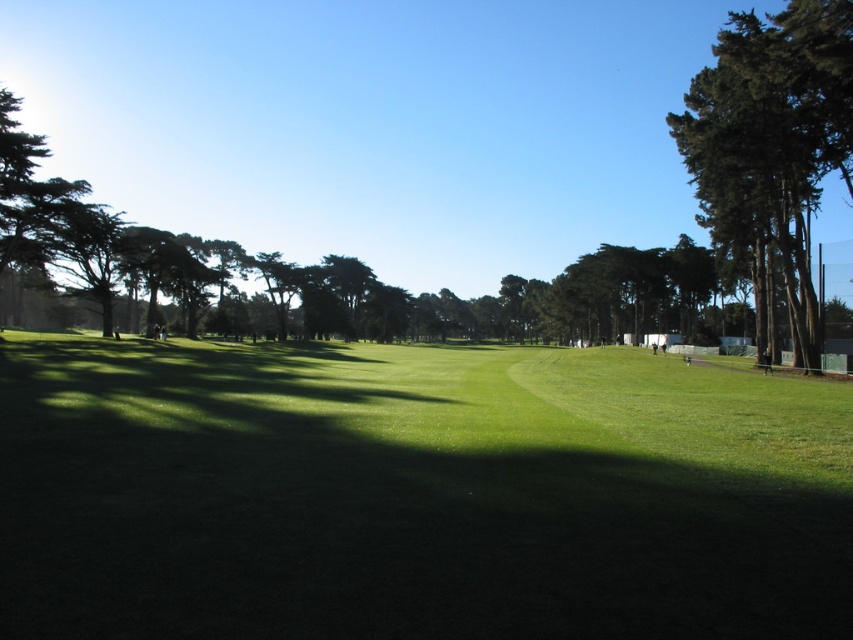
Question: Can you confirm if green grassy field at center is positioned to the left of green textured tree at right?

Choices:
 (A) no
 (B) yes

Answer: (B)

Question: Can you confirm if green grassy field at center is positioned to the right of green textured tree at right?

Choices:
 (A) yes
 (B) no

Answer: (B)

Question: Is green grassy field at center behind green textured tree at right?

Choices:
 (A) no
 (B) yes

Answer: (A)

Question: Which of the following is the closest to the observer?

Choices:
 (A) green grassy field at center
 (B) green textured tree at right

Answer: (A)